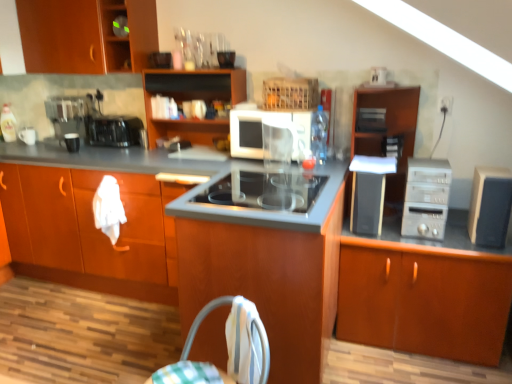
The height and width of the screenshot is (384, 512). Identify the location of clear plastic bottle at center. (319, 134).

What do you see at coordinates (114, 131) in the screenshot? I see `metallic black toaster at left, the second kitchen appliance in the front-to-back sequence` at bounding box center [114, 131].

Locate an element on the screen. The height and width of the screenshot is (384, 512). metallic black toaster at left, placed as the second kitchen appliance when sorted from right to left is located at coordinates (114, 131).

I want to click on wooden cabinet at center, the second cabinetry viewed from the left, so click(x=92, y=218).

This screenshot has width=512, height=384. In order to click on the 5th cabinetry located beneath the white glossy mug at left, placed as the fifth appliance when sorted from front to back (from a real-world perspective) in this screenshot , I will do `click(424, 303)`.

Is white glossy mug at left, placed as the first appliance when sorted from left to right, wider or thinner than brown wood cabinet at right, which ranks as the 1th cabinetry in right-to-left order?

In the image, white glossy mug at left, placed as the first appliance when sorted from left to right, appears to be more narrow than brown wood cabinet at right, which ranks as the 1th cabinetry in right-to-left order.

Is white glossy mug at left, placed as the first appliance when sorted from left to right, in front of brown wood cabinet at right, placed as the seventh cabinetry when sorted from left to right?

No, it is behind brown wood cabinet at right, placed as the seventh cabinetry when sorted from left to right.

Considering the positions of points (134, 128) and (409, 140), is point (134, 128) farther from camera compared to point (409, 140)?

Yes, point (134, 128) is farther from viewer.

Is metallic black toaster at left, the second kitchen appliance in the front-to-back sequence, oriented towards wooden cabinet at right, arranged as the 6th cabinetry when viewed from the left?

No, metallic black toaster at left, the second kitchen appliance in the front-to-back sequence, is not facing towards wooden cabinet at right, arranged as the 6th cabinetry when viewed from the left.

From the image's perspective, which is below, metallic black toaster at left, arranged as the 1th kitchen appliance when viewed from the back, or wooden cabinet at right, which ranks as the second cabinetry in right-to-left order?

wooden cabinet at right, which ranks as the second cabinetry in right-to-left order.

What's the angular difference between wooden cabinet at center, the second cabinetry viewed from the left, and black plastic speaker at right, the third appliance when ordered from left to right,'s facing directions?

0.000294 degrees separate the facing orientations of wooden cabinet at center, the second cabinetry viewed from the left, and black plastic speaker at right, the third appliance when ordered from left to right.

Where is `the 3rd cabinetry in front of the black plastic speaker at right, the third appliance from the right, starting your count from the anchor`? the 3rd cabinetry in front of the black plastic speaker at right, the third appliance from the right, starting your count from the anchor is located at coordinates (92, 218).

Is wooden cabinet at center, positioned as the 6th cabinetry in right-to-left order, in front of or behind black plastic speaker at right, which is counted as the second appliance, starting from the front, in the image?

Visually, wooden cabinet at center, positioned as the 6th cabinetry in right-to-left order, is located in front of black plastic speaker at right, which is counted as the second appliance, starting from the front.

Considering the points (481, 218) and (201, 202), which point is behind, point (481, 218) or point (201, 202)?

The point (201, 202) is behind.

Who is bigger, black matte speaker at right, which is the first appliance from right to left, or stainless steel cooktop at center?

Bigger between the two is stainless steel cooktop at center.

Measure the distance between black matte speaker at right, which is the first appliance from right to left, and stainless steel cooktop at center.

They are 36.76 inches apart.

Is stainless steel cooktop at center at the back of black matte speaker at right, the 1th appliance positioned from the front?

No, stainless steel cooktop at center is not at the back of black matte speaker at right, the 1th appliance positioned from the front.

Which of these two, satin silver toaster at upper center, which is the 3th appliance in front-to-back order, or clear plastic bottle at center, stands shorter?

satin silver toaster at upper center, which is the 3th appliance in front-to-back order.

Which point is more distant from viewer, (368, 131) or (322, 159)?

The point (368, 131) is behind.

Could you tell me if satin silver toaster at upper center, which is the 3th appliance in front-to-back order, is turned towards clear plastic bottle at center?

No, satin silver toaster at upper center, which is the 3th appliance in front-to-back order, is not oriented towards clear plastic bottle at center.

Could clear plastic bottle at center be considered to be inside satin silver toaster at upper center, which ranks as the 2th appliance in right-to-left order?

No, clear plastic bottle at center is not inside satin silver toaster at upper center, which ranks as the 2th appliance in right-to-left order.

In the scene shown: Which object is further away from the camera taking this photo, metallic black toaster at left, the second kitchen appliance in the front-to-back sequence, or wooden cabinet at center, the fifth cabinetry viewed from the left?

metallic black toaster at left, the second kitchen appliance in the front-to-back sequence.

Between metallic black toaster at left, which is the 1th kitchen appliance in left-to-right order, and wooden cabinet at center, the fifth cabinetry viewed from the left, which one has smaller width?

metallic black toaster at left, which is the 1th kitchen appliance in left-to-right order, is thinner.

How far apart are metallic black toaster at left, placed as the second kitchen appliance when sorted from right to left, and wooden cabinet at center, the fifth cabinetry viewed from the left?

metallic black toaster at left, placed as the second kitchen appliance when sorted from right to left, is 5.40 feet from wooden cabinet at center, the fifth cabinetry viewed from the left.

From the image's perspective, would you say white glossy mug at left, the fifth appliance viewed from the right, is positioned over wooden cabinet at center, the second cabinetry viewed from the left?

Yes, from the image's perspective, white glossy mug at left, the fifth appliance viewed from the right, is on top of wooden cabinet at center, the second cabinetry viewed from the left.

Would you say white glossy mug at left, placed as the fifth appliance when sorted from front to back, is outside wooden cabinet at center, the second cabinetry viewed from the left?

Absolutely, white glossy mug at left, placed as the fifth appliance when sorted from front to back, is external to wooden cabinet at center, the second cabinetry viewed from the left.

Considering the sizes of objects white glossy mug at left, placed as the fifth appliance when sorted from front to back, and wooden cabinet at center, positioned as the 6th cabinetry in right-to-left order, in the image provided, who is taller, white glossy mug at left, placed as the fifth appliance when sorted from front to back, or wooden cabinet at center, positioned as the 6th cabinetry in right-to-left order,?

wooden cabinet at center, positioned as the 6th cabinetry in right-to-left order.

Is white glossy mug at left, placed as the fifth appliance when sorted from front to back, directly adjacent to wooden cabinet at center, positioned as the 6th cabinetry in right-to-left order?

No, white glossy mug at left, placed as the fifth appliance when sorted from front to back, is not touching wooden cabinet at center, positioned as the 6th cabinetry in right-to-left order.

Starting from the white glossy mug at left, placed as the fifth appliance when sorted from front to back, which cabinetry is the 7th one to the right? Please provide its 2D coordinates.

[(424, 303)]

In order to click on the 2nd kitchen appliance behind the wooden cabinet at right, which ranks as the second cabinetry in right-to-left order, starting your count from the anchor in this screenshot , I will do `click(114, 131)`.

Looking at the image, which one is located further to stainless steel cooktop at center, wooden cabinet at upper left or wooden cabinet at right, arranged as the 6th cabinetry when viewed from the left?

The object further to stainless steel cooktop at center is wooden cabinet at upper left.

From the image, which object appears to be farther from matte wood cabinets at center, placed as the fifth cabinetry when sorted from right to left, brown wood cabinet at right, placed as the seventh cabinetry when sorted from left to right, or black matte speaker at right, the 1th appliance positioned from the front?

black matte speaker at right, the 1th appliance positioned from the front, is further to matte wood cabinets at center, placed as the fifth cabinetry when sorted from right to left.

Considering their positions, is black plastic speaker at right, the third appliance from the right, positioned closer to black matte speaker at right, the fifth appliance from the back, than white matte microwave at center, which is the second kitchen appliance from left to right?

Among the two, black plastic speaker at right, the third appliance from the right, is located nearer to black matte speaker at right, the fifth appliance from the back.

Which object lies nearer to the anchor point satin silver toaster at upper center, the third appliance from the back, metallic black coffee machine at left or wooden cabinet at upper center, which is the 4th cabinetry from left to right?

Based on the image, wooden cabinet at upper center, which is the 4th cabinetry from left to right, appears to be nearer to satin silver toaster at upper center, the third appliance from the back.

Based on their spatial positions, is metallic black toaster at left, arranged as the 1th kitchen appliance when viewed from the back, or wooden cabinet at right, arranged as the 6th cabinetry when viewed from the left, closer to wooden cabinet at upper center, which is the 4th cabinetry from left to right?

The object closer to wooden cabinet at upper center, which is the 4th cabinetry from left to right, is metallic black toaster at left, arranged as the 1th kitchen appliance when viewed from the back.

Looking at the image, which one is located further to metallic black toaster at left, the second kitchen appliance in the front-to-back sequence, black matte speaker at right, which is the first appliance from right to left, or white glossy mug at left, placed as the first appliance when sorted from left to right?

black matte speaker at right, which is the first appliance from right to left, is positioned further to the anchor metallic black toaster at left, the second kitchen appliance in the front-to-back sequence.

Estimate the real-world distances between objects in this image. Which object is further from metallic black toaster at left, which is the 1th kitchen appliance in left-to-right order, black matte mug at left, which is counted as the 2th appliance, starting from the left, or white glossy mug at left, placed as the first appliance when sorted from left to right?

white glossy mug at left, placed as the first appliance when sorted from left to right, is further to metallic black toaster at left, which is the 1th kitchen appliance in left-to-right order.

Estimate the real-world distances between objects in this image. Which object is further from matte wood cabinets at center, placed as the fifth cabinetry when sorted from right to left, wooden cabinet at right, arranged as the 6th cabinetry when viewed from the left, or wooden cabinet at upper center, which is the 4th cabinetry from left to right?

The object further to matte wood cabinets at center, placed as the fifth cabinetry when sorted from right to left, is wooden cabinet at right, arranged as the 6th cabinetry when viewed from the left.

The width and height of the screenshot is (512, 384). Find the location of `kitchen appliance between wooden cabinet at center, the second cabinetry viewed from the left, and wooden cabinet at upper center, the fourth cabinetry viewed from the right, from front to back`. kitchen appliance between wooden cabinet at center, the second cabinetry viewed from the left, and wooden cabinet at upper center, the fourth cabinetry viewed from the right, from front to back is located at coordinates (262, 132).

In order to click on home appliance between metallic black toaster at left, the second kitchen appliance in the front-to-back sequence, and brown wood cabinet at right, placed as the seventh cabinetry when sorted from left to right, in the horizontal direction in this screenshot , I will do `click(426, 198)`.

Where is `bottle between metallic black toaster at left, placed as the second kitchen appliance when sorted from right to left, and satin silver computer tower at right, in the horizontal direction`? This screenshot has height=384, width=512. bottle between metallic black toaster at left, placed as the second kitchen appliance when sorted from right to left, and satin silver computer tower at right, in the horizontal direction is located at coordinates (319, 134).

This screenshot has height=384, width=512. What are the coordinates of `shelf between metallic black coffee machine at left and wooden cabinet at right, which ranks as the second cabinetry in right-to-left order` in the screenshot? It's located at (129, 34).